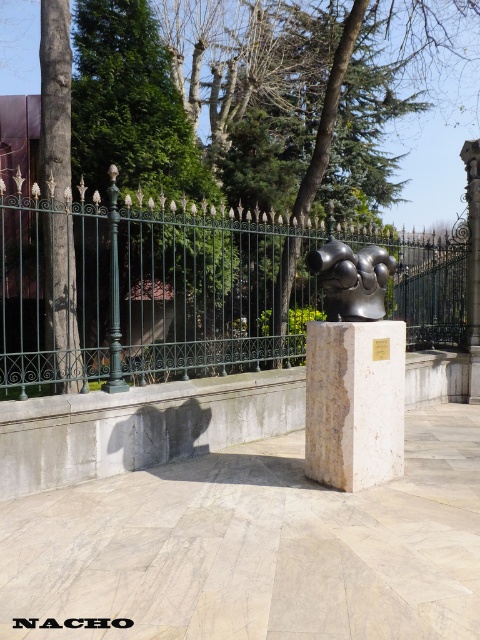
Question: Observing the image, what is the correct spatial positioning of green wrought iron fence at center in reference to smooth bark tree at left?

Choices:
 (A) below
 (B) above

Answer: (A)

Question: Is green wrought iron fence at center thinner than white marble pillar at center?

Choices:
 (A) yes
 (B) no

Answer: (A)

Question: Which object is positioned farthest from the smooth bark tree at left?

Choices:
 (A) white marble pillar at center
 (B) polished bronze sculpture at center

Answer: (A)

Question: Does smooth bark tree at left have a smaller size compared to polished bronze sculpture at center?

Choices:
 (A) yes
 (B) no

Answer: (B)

Question: Which object appears closest to the camera in this image?

Choices:
 (A) white marble pillar at center
 (B) smooth bark tree at left
 (C) green wrought iron fence at center
 (D) polished bronze sculpture at center

Answer: (A)

Question: Which point appears closest to the camera in this image?

Choices:
 (A) (62, 170)
 (B) (387, 449)
 (C) (225, 298)

Answer: (B)